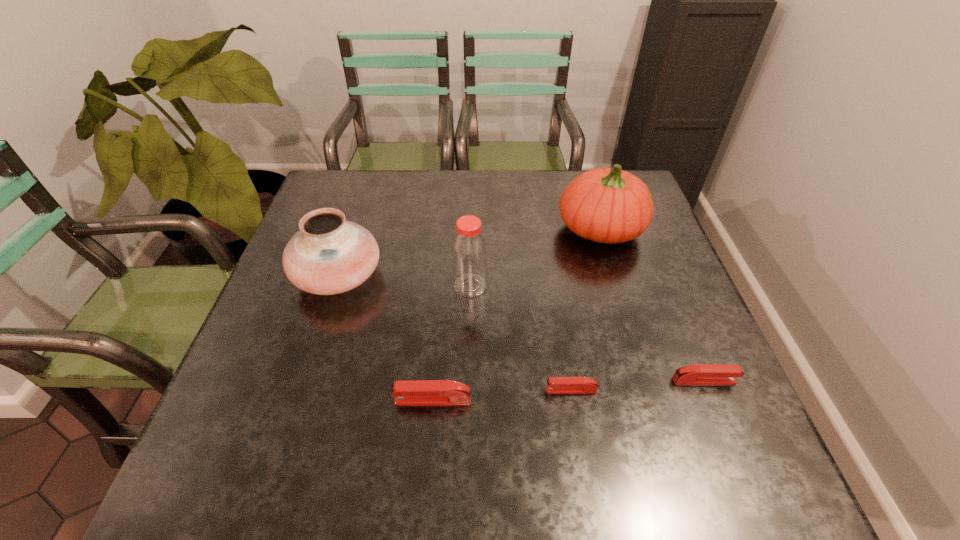
Where is `the nearest stapler`? Image resolution: width=960 pixels, height=540 pixels. the nearest stapler is located at coordinates (410, 392).

I want to click on the tallest stapler, so click(410, 392).

Where is `the second farthest stapler`? the second farthest stapler is located at coordinates (555, 385).

This screenshot has width=960, height=540. Find the location of `the shortest object`. the shortest object is located at coordinates (555, 385).

Locate an element on the screen. The width and height of the screenshot is (960, 540). the fourth farthest object is located at coordinates (698, 374).

Identify the location of the second shortest stapler. (698, 374).

In order to click on bottle in this screenshot , I will do `click(469, 251)`.

Where is `pumpkin`? This screenshot has height=540, width=960. pumpkin is located at coordinates (606, 205).

Find the location of a particular element. the leftmost object is located at coordinates (x=328, y=255).

Locate an element on the screen. free space located on the front-facing side of the nearest stapler is located at coordinates (298, 400).